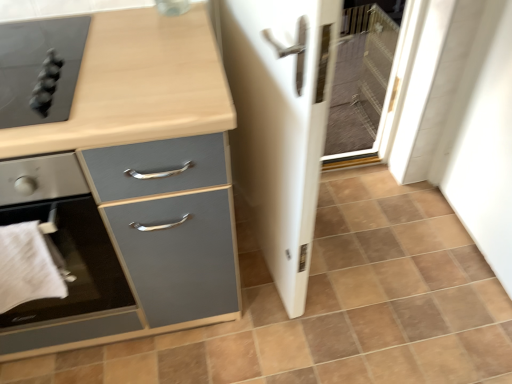
Identify the location of vacant area that is in front of white glossy screen door at center. (291, 337).